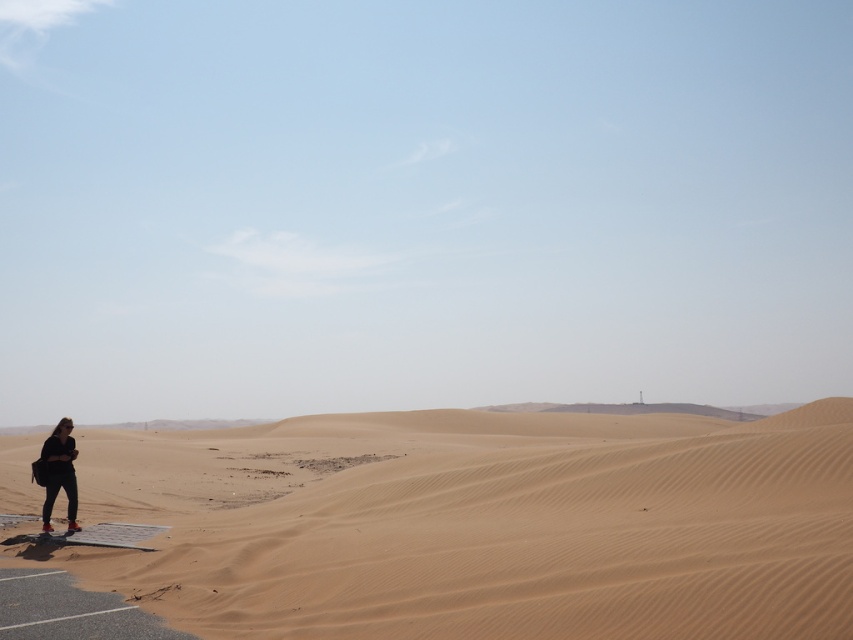
Question: Which point is farther to the camera?

Choices:
 (A) sandy beige dunes at lower left
 (B) matte black jacket at lower left

Answer: (B)

Question: Does sandy beige dunes at lower left have a lesser width compared to matte black jacket at lower left?

Choices:
 (A) yes
 (B) no

Answer: (B)

Question: Does sandy beige dunes at lower left appear over matte black jacket at lower left?

Choices:
 (A) no
 (B) yes

Answer: (A)

Question: Which of the following is the closest to the observer?

Choices:
 (A) (746, 490)
 (B) (42, 513)

Answer: (A)

Question: Which point appears farthest from the camera in this image?

Choices:
 (A) (427, 620)
 (B) (68, 442)

Answer: (B)

Question: Is sandy beige dunes at lower left closer to the viewer compared to matte black jacket at lower left?

Choices:
 (A) yes
 (B) no

Answer: (A)